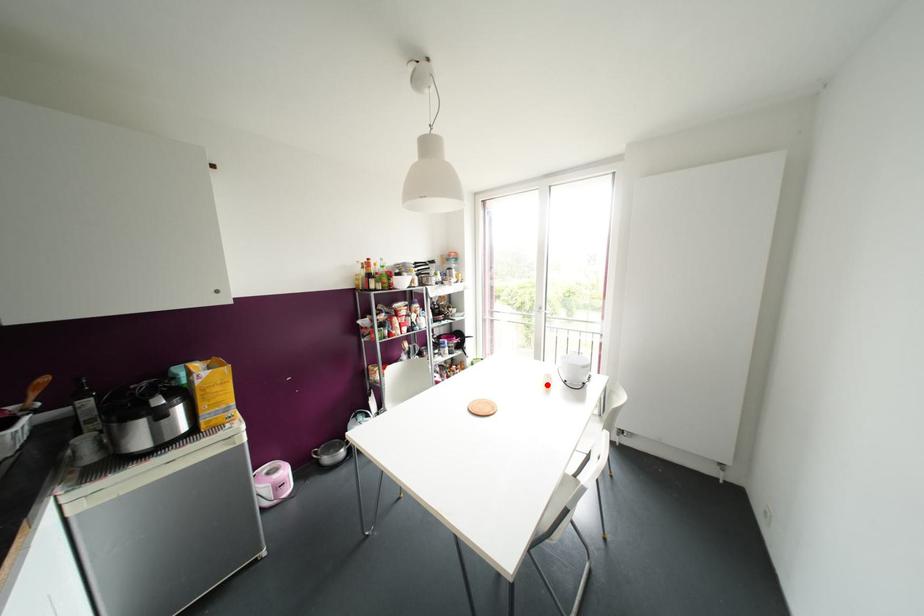
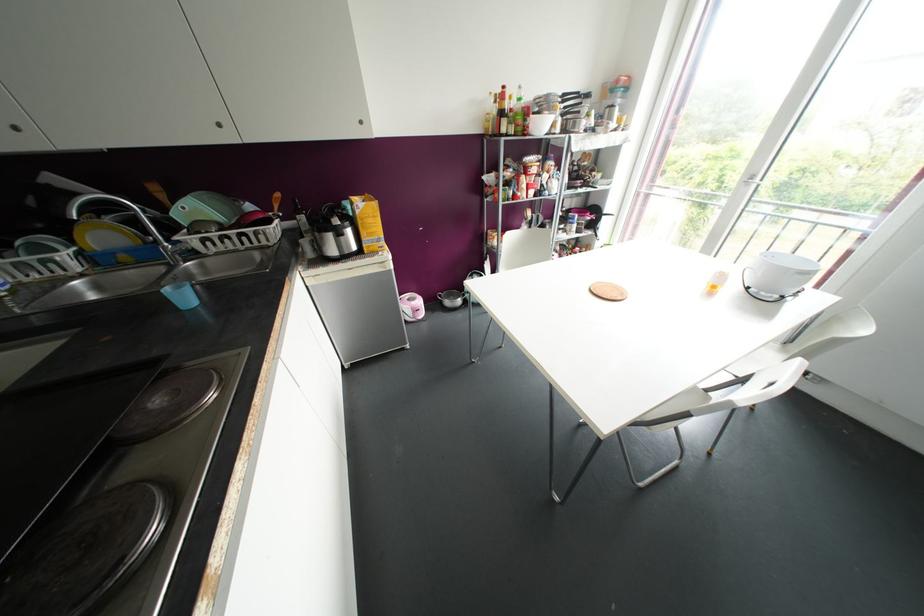
In the second image, find the point that corresponds to the highlighted location in the first image.

(713, 286)